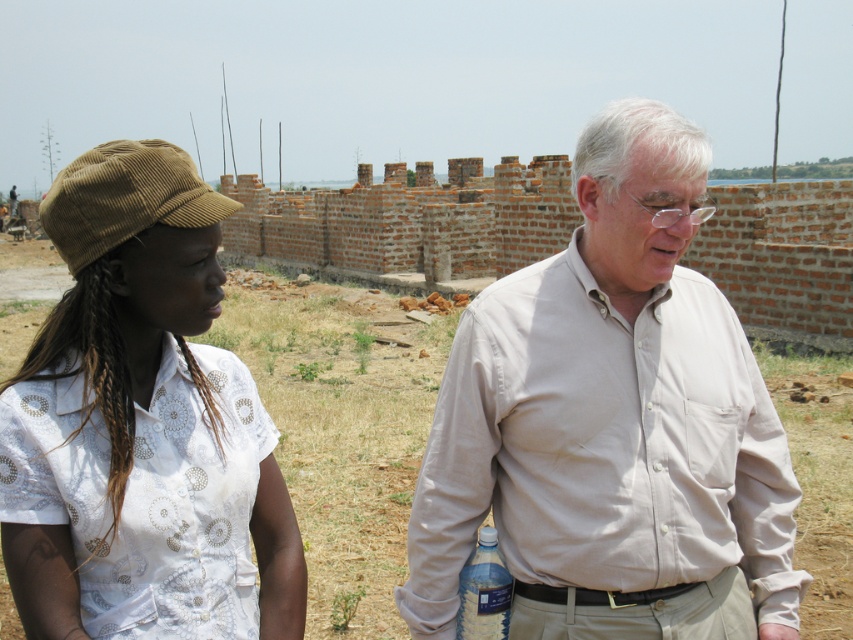
Is beige cotton shirt at center above brown corduroy cap at left?

Actually, beige cotton shirt at center is below brown corduroy cap at left.

Measure the distance between beige cotton shirt at center and brown corduroy cap at left.

They are 1.39 meters apart.

Where is `beige cotton shirt at center`? This screenshot has width=853, height=640. beige cotton shirt at center is located at coordinates (611, 422).

Does beige cotton shirt at center appear on the left side of clear plastic bottle at lower center?

In fact, beige cotton shirt at center is to the right of clear plastic bottle at lower center.

I want to click on beige cotton shirt at center, so click(x=611, y=422).

Does brown dry grass at center have a lesser width compared to clear plastic bottle at lower center?

Incorrect, brown dry grass at center's width is not less than clear plastic bottle at lower center's.

Between point (816, 531) and point (479, 618), which one is positioned behind?

The point (816, 531) is more distant.

Is point (332, 573) closer to camera compared to point (480, 572)?

No, it is not.

Where is `brown dry grass at center`? This screenshot has width=853, height=640. brown dry grass at center is located at coordinates (341, 428).